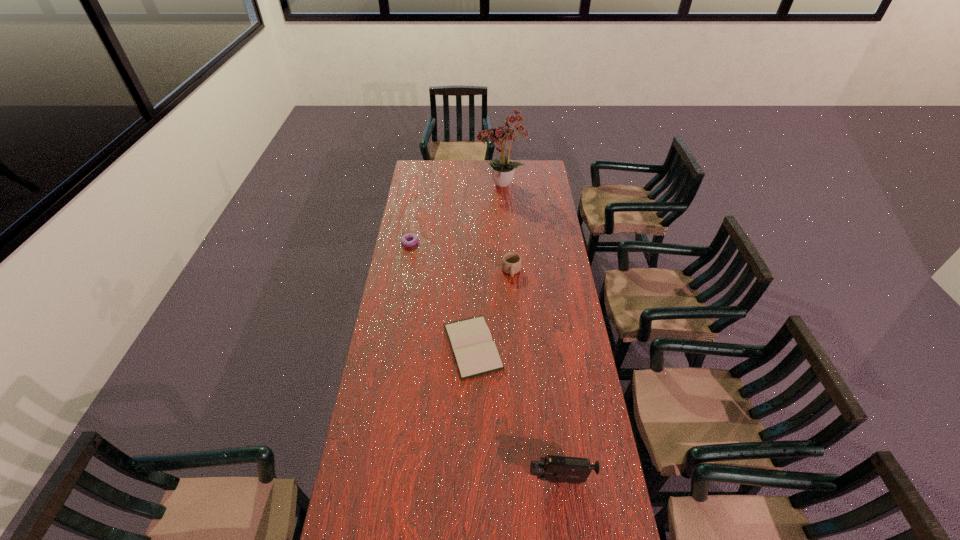
This screenshot has height=540, width=960. Identify the location of object situated at the left edge. (405, 237).

At what (x,y) coordinates should I click in order to perform the action: click on flower arrangement situated at the right edge. Please return your answer as a coordinate pair (x, y). This screenshot has height=540, width=960. Looking at the image, I should click on (503, 170).

You are a GUI agent. You are given a task and a screenshot of the screen. Output one action in this format:
    pyautogui.click(x=<x>, y=<y>)
    Task: Click on the camcorder that is positioned at the right edge
    The width and height of the screenshot is (960, 540).
    Given the screenshot: What is the action you would take?
    pyautogui.click(x=554, y=469)

The height and width of the screenshot is (540, 960). Find the location of `object that is at the far right corner`. object that is at the far right corner is located at coordinates (503, 170).

The image size is (960, 540). Identify the location of vacant region at the left edge of the desktop. (396, 265).

The height and width of the screenshot is (540, 960). What are the coordinates of `free location at the right edge` in the screenshot? It's located at (536, 206).

At what (x,y) coordinates should I click in order to perform the action: click on free space at the far left corner. Please return your answer as a coordinate pair (x, y). Looking at the image, I should click on (420, 173).

This screenshot has width=960, height=540. In the image, there is a desktop. What are the coordinates of `free space at the far right corner` in the screenshot? It's located at (532, 169).

I want to click on empty space that is in between the flower arrangement and the third tallest object, so click(x=506, y=228).

Locate an element on the screen. This screenshot has width=960, height=540. vacant area that lies between the shortest object and the nearest object is located at coordinates (516, 413).